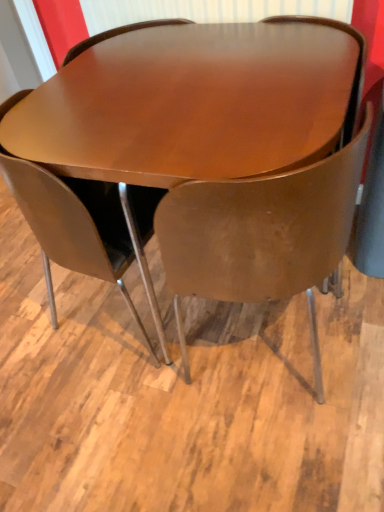
You are a GUI agent. You are given a task and a screenshot of the screen. Output one action in this format:
    pyautogui.click(x=<x>, y=<y>)
    Task: Click on the free location in front of matte brown chair at center, acting as the first chair starting from the left
    This screenshot has width=384, height=512.
    Given the screenshot: What is the action you would take?
    pyautogui.click(x=124, y=416)